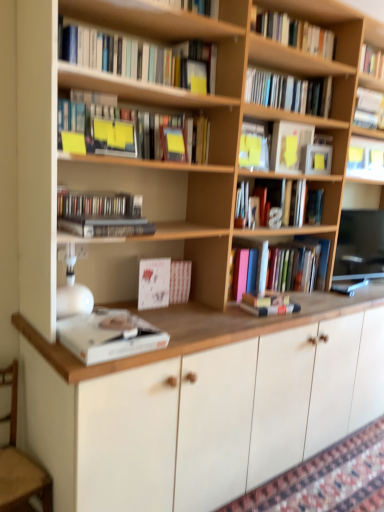
The image size is (384, 512). Find the location of `blank area to the left of hardcover book at center, which is counted as the 2th book, starting from the bottom`. blank area to the left of hardcover book at center, which is counted as the 2th book, starting from the bottom is located at coordinates (233, 311).